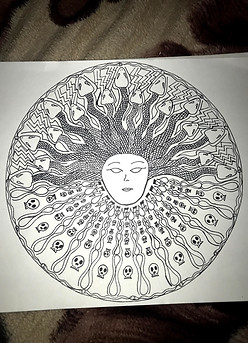
The image size is (248, 343). Find the location of `white rug`. white rug is located at coordinates 57,51.